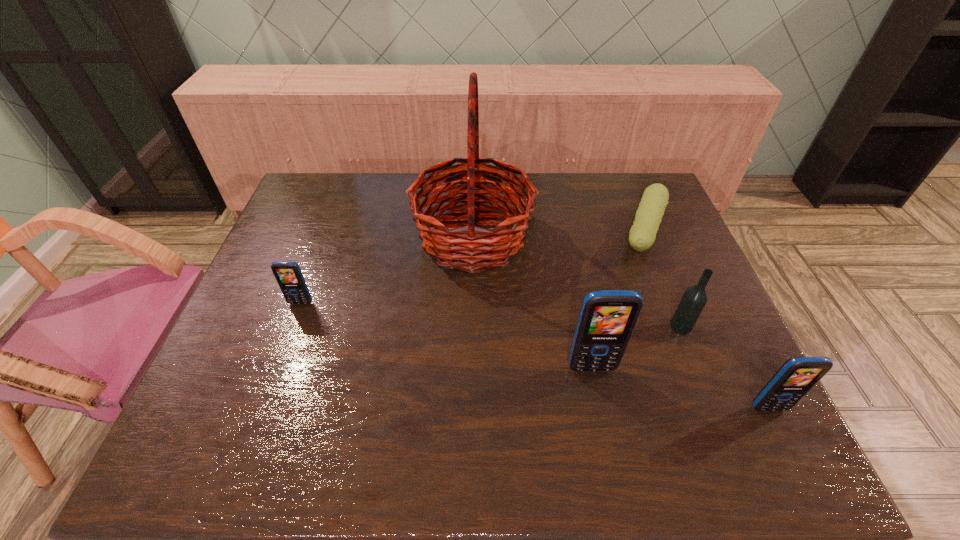
Locate an element on the screen. Image resolution: width=960 pixels, height=540 pixels. vacant area situated on the screen of the leftmost object is located at coordinates (276, 370).

This screenshot has width=960, height=540. What are the coordinates of `free spot located on the handle side of the fifth object from right to left` in the screenshot? It's located at (587, 238).

Image resolution: width=960 pixels, height=540 pixels. I want to click on free space located on the left of the cucumber, so click(x=581, y=233).

The image size is (960, 540). What are the coordinates of `vacant space located on the back of the fourth farthest object` in the screenshot? It's located at (670, 300).

Find the location of a particular element. Image resolution: width=960 pixels, height=540 pixels. basket that is at the far edge is located at coordinates (467, 248).

What are the coordinates of `cucumber located at the far edge` in the screenshot? It's located at (642, 235).

At what (x,y) coordinates should I click in order to perform the action: click on object present at the near edge. Please return your answer as a coordinate pair (x, y). Looking at the image, I should click on (797, 375).

This screenshot has width=960, height=540. I want to click on object that is at the left edge, so click(x=288, y=274).

Locate an element on the screen. The width and height of the screenshot is (960, 540). cellular telephone that is at the right edge is located at coordinates (797, 375).

You are a GUI agent. You are given a task and a screenshot of the screen. Output one action in this format:
    pyautogui.click(x=<x>, y=<y>)
    Task: Click on the cucumber present at the right edge
    The width and height of the screenshot is (960, 540).
    Given the screenshot: What is the action you would take?
    pyautogui.click(x=642, y=235)